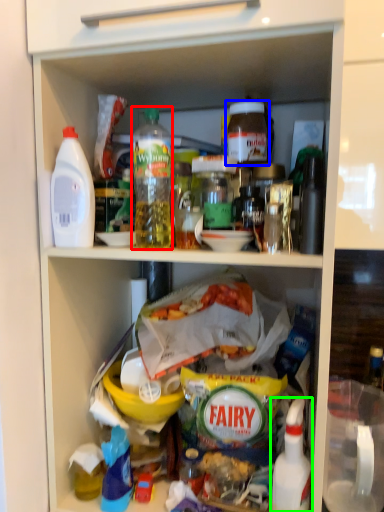
Question: Considering the real-world distances, which object is farthest from bottle (highlighted by a red box)? bottle (highlighted by a blue box) or bottle (highlighted by a green box)?

Choices:
 (A) bottle
 (B) bottle

Answer: (B)